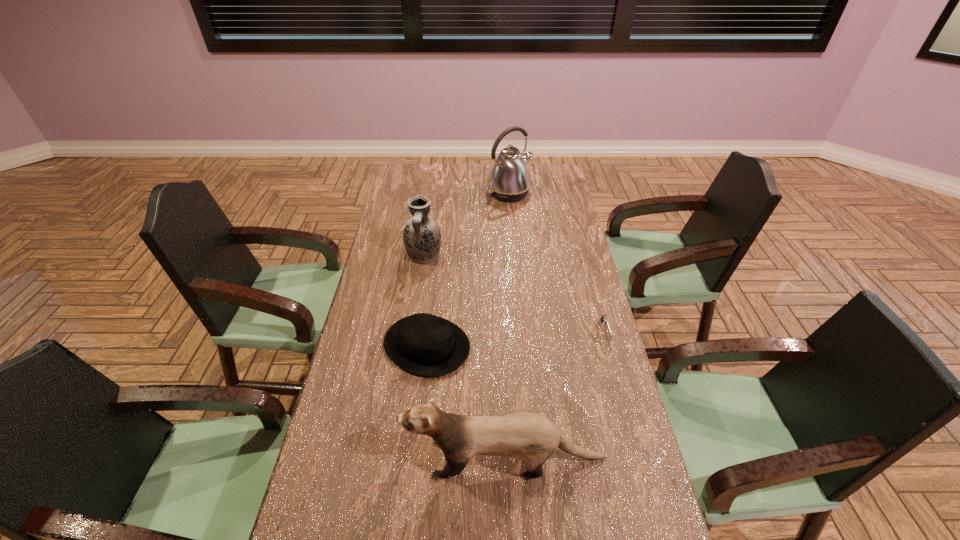
Where is `vacant space located on the face of the nearest object`? vacant space located on the face of the nearest object is located at coordinates (382, 458).

Where is `vacant region located on the face of the nearest object`? The height and width of the screenshot is (540, 960). vacant region located on the face of the nearest object is located at coordinates (323, 458).

At what (x,y) coordinates should I click in order to perform the action: click on vacant space located on the front of the fedora. Please return your answer as a coordinate pair (x, y). Looking at the image, I should click on (411, 482).

At what (x,y) coordinates should I click in order to perform the action: click on vacant space located on the front-facing side of the shortest object. Please return your answer as a coordinate pair (x, y). Image resolution: width=960 pixels, height=540 pixels. Looking at the image, I should click on (641, 465).

You are a GUI agent. You are given a task and a screenshot of the screen. Output one action in this format:
    pyautogui.click(x=<x>, y=<y>)
    Task: Click on the object present at the far edge
    Image resolution: width=960 pixels, height=540 pixels.
    Given the screenshot: What is the action you would take?
    click(x=509, y=180)

Identify the location of vase that is at the left edge. (422, 238).

Find the location of a particular element. fedora at the left edge is located at coordinates (423, 344).

Find the location of a particular element. ferret present at the right edge is located at coordinates (532, 437).

Locate an element on the screen. The height and width of the screenshot is (540, 960). pistol located in the right edge section of the desktop is located at coordinates (604, 318).

Locate an element on the screen. The image size is (960, 540). vacant space at the far edge of the desktop is located at coordinates (479, 165).